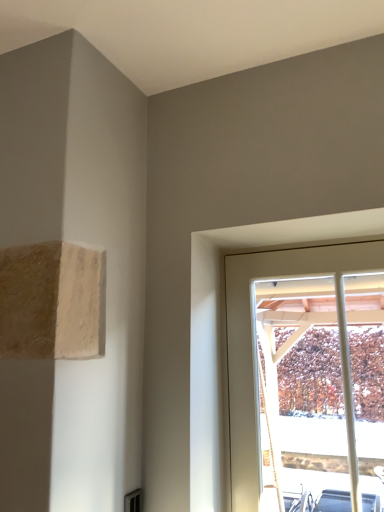
Question: Should I look upward or downward to see white wood window at upper right?

Choices:
 (A) down
 (B) up

Answer: (A)